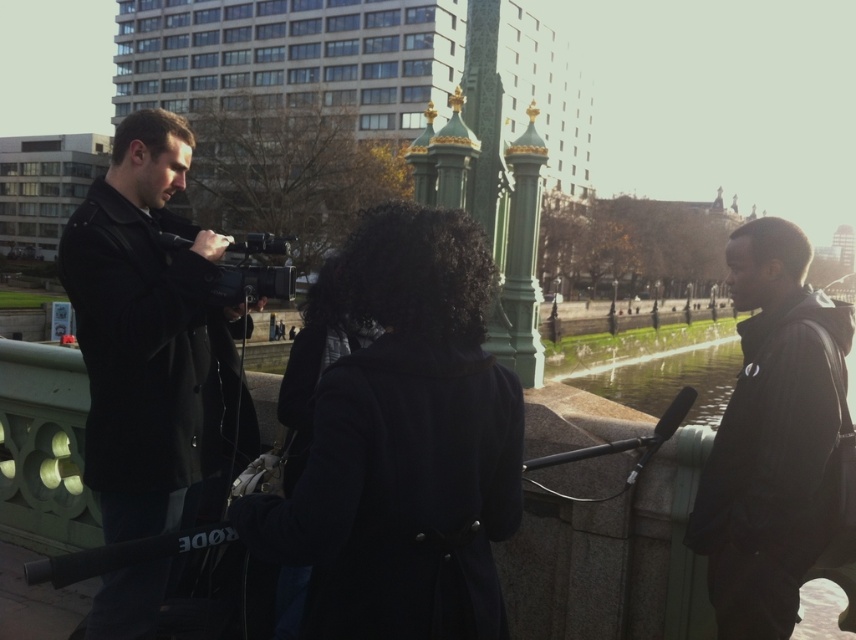
Question: Estimate the real-world distances between objects in this image. Which object is farther from the black matte video camera at center?

Choices:
 (A) dark wool coat at center
 (B) clear glass water at center

Answer: (B)

Question: Considering the relative positions of dark wool coat at center and black leather jacket at left in the image provided, where is dark wool coat at center located with respect to black leather jacket at left?

Choices:
 (A) above
 (B) below

Answer: (B)

Question: Which point is farther to the camera?

Choices:
 (A) (609, 372)
 (B) (187, 445)

Answer: (A)

Question: Which object appears closest to the camera in this image?

Choices:
 (A) black matte jacket at right
 (B) black leather jacket at left
 (C) dark wool coat at center

Answer: (C)

Question: Can you confirm if black matte jacket at right is bigger than clear glass water at center?

Choices:
 (A) yes
 (B) no

Answer: (B)

Question: Observing the image, what is the correct spatial positioning of black matte jacket at right in reference to clear glass water at center?

Choices:
 (A) left
 (B) right

Answer: (A)